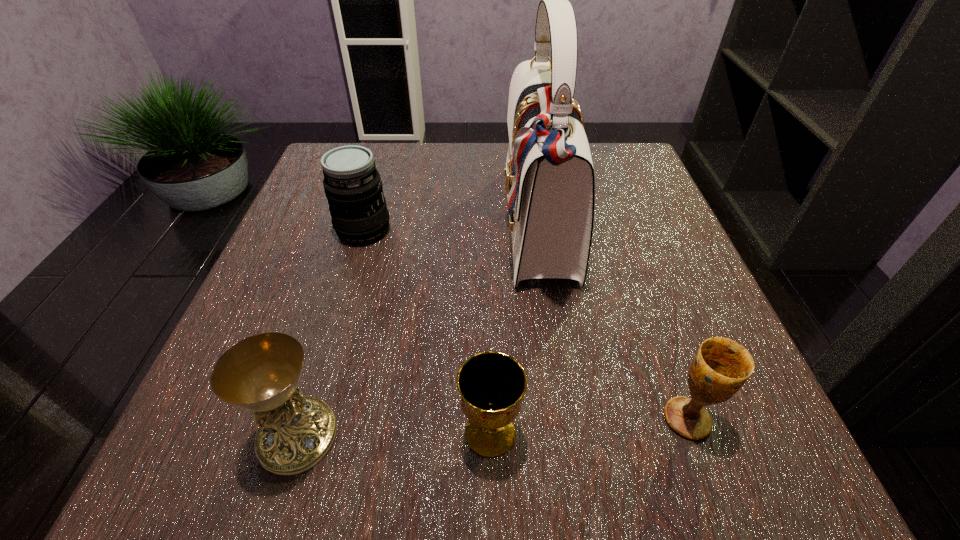
I want to click on satchel, so click(x=550, y=186).

Identify the location of telephoto lens. The width and height of the screenshot is (960, 540). (353, 187).

The image size is (960, 540). I want to click on the leftmost chalice, so click(x=260, y=373).

Image resolution: width=960 pixels, height=540 pixels. I want to click on the rightmost chalice, so click(721, 366).

The height and width of the screenshot is (540, 960). Identify the location of the second chalice from right to left. (492, 384).

At what (x,y) coordinates should I click in order to perform the action: click on vacant region located on the front-facing side of the satchel. Please return your answer as a coordinate pair (x, y). The height and width of the screenshot is (540, 960). Looking at the image, I should click on (419, 227).

Where is `vacant area situated 0.310m on the front-facing side of the satchel`? The width and height of the screenshot is (960, 540). vacant area situated 0.310m on the front-facing side of the satchel is located at coordinates (x=348, y=227).

You are a GUI agent. You are given a task and a screenshot of the screen. Output one action in this format:
    pyautogui.click(x=<x>, y=<y>)
    Task: Click on the vacant space located 0.130m on the front-facing side of the satchel
    The height and width of the screenshot is (540, 960).
    Given the screenshot: What is the action you would take?
    pyautogui.click(x=438, y=227)

Locate an element on the screen. The image size is (960, 540). vacant space situated 0.090m on the front of the telephoto lens is located at coordinates 348,281.

Where is `free space located on the back of the leftmost chalice`? free space located on the back of the leftmost chalice is located at coordinates (342, 291).